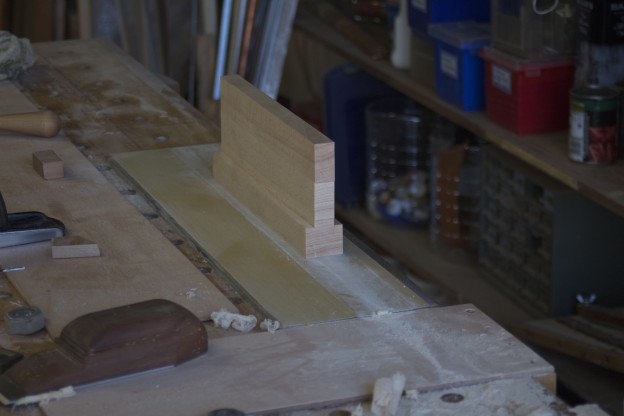
The width and height of the screenshot is (624, 416). I want to click on craft supplies, so click(x=225, y=32).